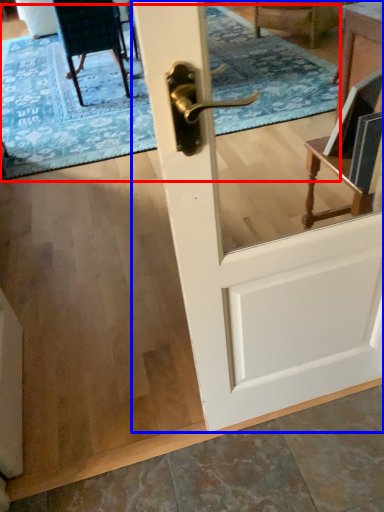
Question: Which of the following is the farthest to the observer, doormat (highlighted by a red box) or door (highlighted by a blue box)?

Choices:
 (A) doormat
 (B) door

Answer: (A)